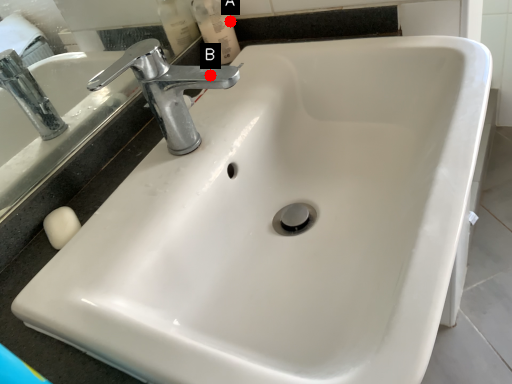
Question: Two points are circled on the image, labeled by A and B beside each circle. Which of the following is the farthest from the observer?

Choices:
 (A) A is further
 (B) B is further

Answer: (A)